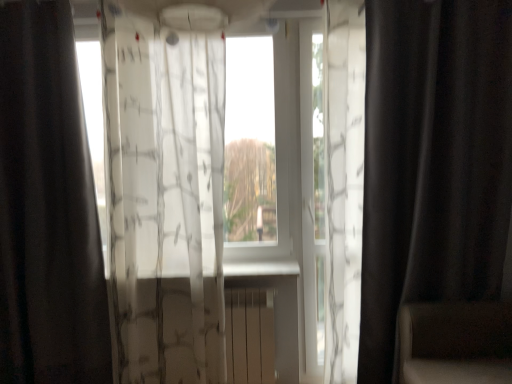
Describe the element at coordinates (47, 208) in the screenshot. I see `black matte curtain at left, which appears as the third curtain when viewed from the right` at that location.

Measure the distance between white plastic radiator at center and camera.

white plastic radiator at center and camera are 2.43 meters apart from each other.

What do you see at coordinates (433, 163) in the screenshot? The image size is (512, 384). I see `black matte curtain at right, the 1th curtain from the right` at bounding box center [433, 163].

The width and height of the screenshot is (512, 384). I want to click on black matte curtain at right, the 1th curtain from the right, so click(x=433, y=163).

The height and width of the screenshot is (384, 512). Identify the location of dark brown leather armchair at right. (456, 343).

Where is `black matte curtain at left, which is the 1th curtain in left-to-right order`? black matte curtain at left, which is the 1th curtain in left-to-right order is located at coordinates (47, 208).

Can you confirm if black matte curtain at left, which appears as the third curtain when viewed from the right, is thinner than white plastic radiator at center?

Yes.

Can you confirm if black matte curtain at left, which appears as the third curtain when viewed from the right, is bigger than white plastic radiator at center?

Correct, black matte curtain at left, which appears as the third curtain when viewed from the right, is larger in size than white plastic radiator at center.

From the picture: Would you say black matte curtain at left, which is the 1th curtain in left-to-right order, is outside white plastic radiator at center?

Yes, black matte curtain at left, which is the 1th curtain in left-to-right order, is located beyond the bounds of white plastic radiator at center.

From the image's perspective, would you say black matte curtain at left, which appears as the third curtain when viewed from the right, is shown under white plastic radiator at center?

Incorrect, from the image's perspective, black matte curtain at left, which appears as the third curtain when viewed from the right, is higher than white plastic radiator at center.

Who is shorter, black matte curtain at right, the 1th curtain from the right, or dark brown leather armchair at right?

With less height is dark brown leather armchair at right.

Considering the positions of objects black matte curtain at right, the 1th curtain from the right, and dark brown leather armchair at right in the image provided, who is more to the left, black matte curtain at right, the 1th curtain from the right, or dark brown leather armchair at right?

black matte curtain at right, the 1th curtain from the right, is more to the left.

Consider the image. From the image's perspective, who appears lower, black matte curtain at right, which is the third curtain in left-to-right order, or dark brown leather armchair at right?

From the image's view, dark brown leather armchair at right is below.

In order to click on armchair below the black matte curtain at right, the 1th curtain from the right (from a real-world perspective) in this screenshot , I will do `click(456, 343)`.

In terms of width, does black matte curtain at right, which is the third curtain in left-to-right order, look wider or thinner when compared to transparent fabric at center?

Clearly, black matte curtain at right, which is the third curtain in left-to-right order, has more width compared to transparent fabric at center.

Is black matte curtain at right, the 1th curtain from the right, in front of transparent fabric at center?

Yes, black matte curtain at right, the 1th curtain from the right, is closer to the camera.

Who is smaller, black matte curtain at right, which is the third curtain in left-to-right order, or transparent fabric at center?

transparent fabric at center.

How many degrees apart are the facing directions of black matte curtain at right, the 1th curtain from the right, and transparent fabric at center?

black matte curtain at right, the 1th curtain from the right, and transparent fabric at center are facing 0.000339 degrees away from each other.

Considering the relative sizes of white plastic radiator at center and black matte curtain at left, which appears as the third curtain when viewed from the right, in the image provided, is white plastic radiator at center smaller than black matte curtain at left, which appears as the third curtain when viewed from the right,?

Yes, white plastic radiator at center is smaller than black matte curtain at left, which appears as the third curtain when viewed from the right.

Does white plastic radiator at center turn towards black matte curtain at left, which appears as the third curtain when viewed from the right?

No, white plastic radiator at center is not aimed at black matte curtain at left, which appears as the third curtain when viewed from the right.

Considering the positions of objects white plastic radiator at center and black matte curtain at left, which is the 1th curtain in left-to-right order, in the image provided, who is in front, white plastic radiator at center or black matte curtain at left, which is the 1th curtain in left-to-right order,?

black matte curtain at left, which is the 1th curtain in left-to-right order.

In terms of height, does white plastic radiator at center look taller or shorter compared to black matte curtain at left, which is the 1th curtain in left-to-right order?

Clearly, white plastic radiator at center is shorter compared to black matte curtain at left, which is the 1th curtain in left-to-right order.

Considering the sizes of objects dark brown leather armchair at right and translucent white curtain at center, the second curtain in the right-to-left sequence, in the image provided, who is wider, dark brown leather armchair at right or translucent white curtain at center, the second curtain in the right-to-left sequence,?

Wider between the two is dark brown leather armchair at right.

From the image's perspective, is dark brown leather armchair at right located beneath translucent white curtain at center, the second curtain in the right-to-left sequence?

Yes.

Is dark brown leather armchair at right oriented away from translucent white curtain at center, the second curtain in the right-to-left sequence?

No.

Consider the image. Would you say dark brown leather armchair at right is to the left or to the right of translucent white curtain at center, positioned as the second curtain in left-to-right order, in the picture?

In the image, dark brown leather armchair at right appears on the right side of translucent white curtain at center, positioned as the second curtain in left-to-right order.

Locate an element on the screen. radiator on the right of transparent fabric at center is located at coordinates (250, 336).

From a real-world perspective, which is physically above, matte beige radiator at center or transparent fabric at center?

transparent fabric at center, from a real-world perspective.

Is matte beige radiator at center inside or outside of transparent fabric at center?

matte beige radiator at center is outside transparent fabric at center.

Are matte beige radiator at center and transparent fabric at center beside each other?

matte beige radiator at center and transparent fabric at center are not in contact.

Based on the photo, from a real-world perspective, is black matte curtain at left, which appears as the third curtain when viewed from the right, below black matte curtain at right, the 1th curtain from the right?

Actually, black matte curtain at left, which appears as the third curtain when viewed from the right, is physically above black matte curtain at right, the 1th curtain from the right, in the real world.

Is black matte curtain at right, the 1th curtain from the right, located within black matte curtain at left, which appears as the third curtain when viewed from the right?

No.

Locate an element on the screen. This screenshot has width=512, height=384. the 2nd curtain to the right of the black matte curtain at left, which appears as the third curtain when viewed from the right, counting from the anchor's position is located at coordinates (433, 163).

How far apart are black matte curtain at left, which is the 1th curtain in left-to-right order, and black matte curtain at right, which is the third curtain in left-to-right order?

black matte curtain at left, which is the 1th curtain in left-to-right order, and black matte curtain at right, which is the third curtain in left-to-right order, are 1.79 meters apart.

This screenshot has width=512, height=384. I want to click on window sill that is under the black matte curtain at left, which appears as the third curtain when viewed from the right (from a real-world perspective), so click(260, 269).

From a real-world perspective, starting from the dark brown leather armchair at right, which curtain is the 1st one vertically above it? Please provide its 2D coordinates.

[(433, 163)]

From the picture: Estimate the real-world distances between objects in this image. Which object is further from dark brown leather armchair at right, black matte curtain at right, the 1th curtain from the right, or transparent fabric at center?

The object further to dark brown leather armchair at right is transparent fabric at center.

When comparing their distances from white plastic radiator at center, does black matte curtain at left, which appears as the third curtain when viewed from the right, or dark brown leather armchair at right seem closer?

dark brown leather armchair at right is closer to white plastic radiator at center.

Considering their positions, is black matte curtain at left, which is the 1th curtain in left-to-right order, positioned closer to white plastic radiator at center than matte beige radiator at center?

Based on the image, matte beige radiator at center appears to be nearer to white plastic radiator at center.

Looking at the image, which one is located closer to dark brown leather armchair at right, black matte curtain at right, the 1th curtain from the right, or matte beige radiator at center?

black matte curtain at right, the 1th curtain from the right, is closer to dark brown leather armchair at right.

Looking at this image, looking at the image, which one is located closer to matte beige radiator at center, black matte curtain at right, which is the third curtain in left-to-right order, or black matte curtain at left, which appears as the third curtain when viewed from the right?

Based on the image, black matte curtain at right, which is the third curtain in left-to-right order, appears to be nearer to matte beige radiator at center.

Considering their positions, is matte beige radiator at center positioned further to translucent white curtain at center, positioned as the second curtain in left-to-right order, than black matte curtain at left, which appears as the third curtain when viewed from the right?

Among the two, matte beige radiator at center is located further to translucent white curtain at center, positioned as the second curtain in left-to-right order.

In the scene shown: From the image, which object appears to be nearer to translucent white curtain at center, the second curtain in the right-to-left sequence, white plastic radiator at center or black matte curtain at right, the 1th curtain from the right?

white plastic radiator at center is positioned closer to the anchor translucent white curtain at center, the second curtain in the right-to-left sequence.

Considering their positions, is translucent white curtain at center, the second curtain in the right-to-left sequence, positioned closer to transparent fabric at center than black matte curtain at left, which is the 1th curtain in left-to-right order?

translucent white curtain at center, the second curtain in the right-to-left sequence, is positioned closer to the anchor transparent fabric at center.

You are a GUI agent. You are given a task and a screenshot of the screen. Output one action in this format:
    pyautogui.click(x=<x>, y=<y>)
    Task: Click on the curtain situated between translucent white curtain at center, the second curtain in the right-to-left sequence, and dark brown leather armchair at right from left to right
    
    Given the screenshot: What is the action you would take?
    pyautogui.click(x=433, y=163)

Where is `window screen between black matte curtain at left, which is the 1th curtain in left-to-right order, and black matte curtain at right, the 1th curtain from the right, in the horizontal direction`? Image resolution: width=512 pixels, height=384 pixels. window screen between black matte curtain at left, which is the 1th curtain in left-to-right order, and black matte curtain at right, the 1th curtain from the right, in the horizontal direction is located at coordinates [x=137, y=121].

In order to click on window sill between transparent fabric at center and matte beige radiator at center in the vertical direction in this screenshot , I will do `click(260, 269)`.

Identify the location of window sill between black matte curtain at left, which is the 1th curtain in left-to-right order, and black matte curtain at right, the 1th curtain from the right, in the horizontal direction. This screenshot has width=512, height=384. (260, 269).